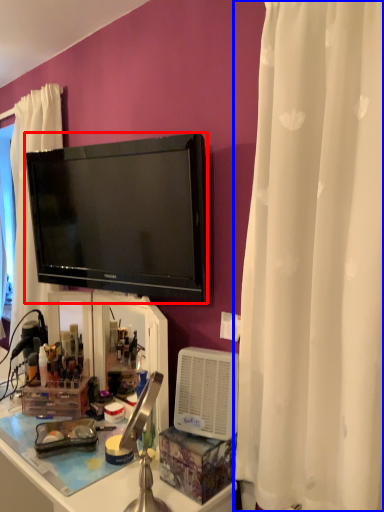
Question: Which point is closer to the camera, television (highlighted by a red box) or curtain (highlighted by a blue box)?

Choices:
 (A) television
 (B) curtain

Answer: (B)